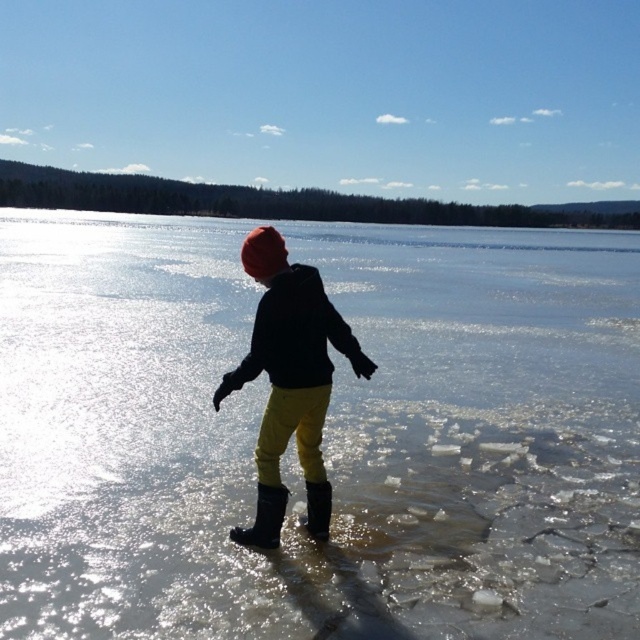
You are a hiker trying to cross the frozen lake. You see transparent ice at center and black rubber boot at lower center. Which path is safer to walk on?

The transparent ice at center is wider than the black rubber boot at lower center, so it is safer to walk on the transparent ice at center because wider ice is typically stronger and more stable than thinner ice.

You are a photographer trying to capture the winter scene. You notice the yellow matte pants at center and the black rubber boot at lower center. Which object is located higher in the image?

The yellow matte pants at center is positioned over the black rubber boot at lower center, so it is higher in the image.